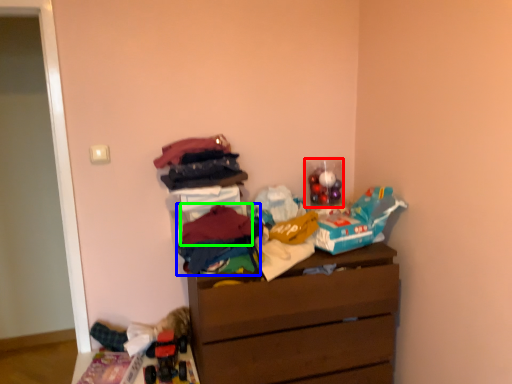
Question: Considering the real-world distances, which object is farthest from toy (highlighted by a red box)? clothing (highlighted by a blue box) or clothing (highlighted by a green box)?

Choices:
 (A) clothing
 (B) clothing

Answer: (B)